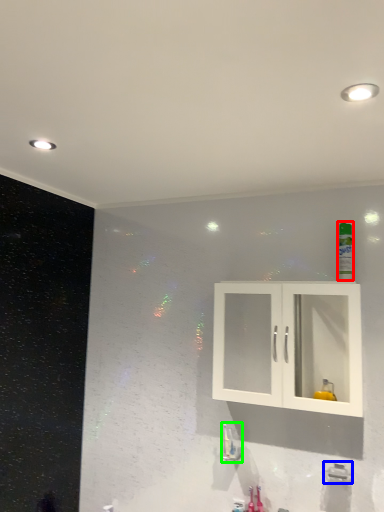
Question: Which is nearer to the mouthwash (highlighted by a red box)? plumbing fixture (highlighted by a blue box) or plumbing fixture (highlighted by a green box).

Choices:
 (A) plumbing fixture
 (B) plumbing fixture

Answer: (A)